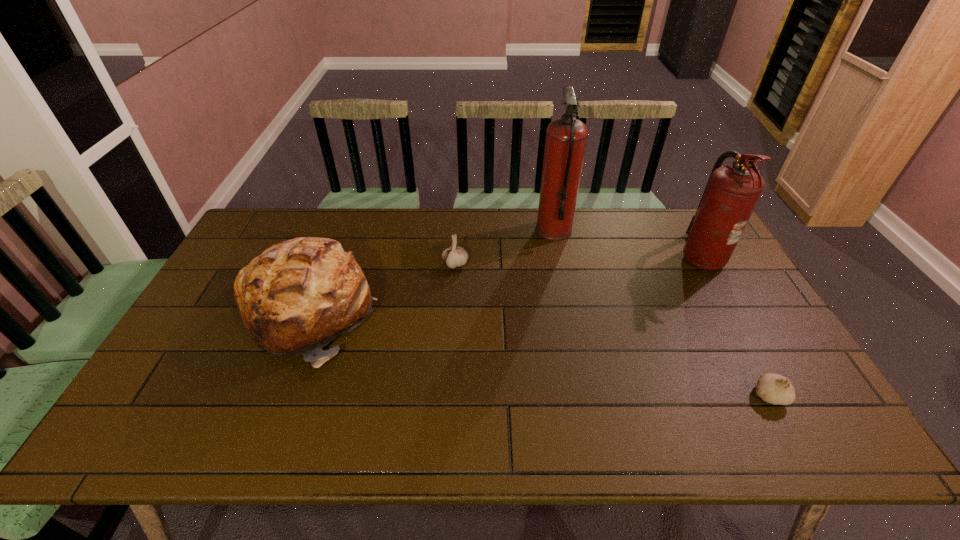
Where is `vacant point that satisfies the following two spatial constraints: 1. on the back side of the taller garlic; 2. on the left side of the bread`? This screenshot has width=960, height=540. vacant point that satisfies the following two spatial constraints: 1. on the back side of the taller garlic; 2. on the left side of the bread is located at coordinates (328, 264).

In order to click on vacant region that satisfies the following two spatial constraints: 1. at the nozzle of the third object from left to right; 2. on the front side of the taller garlic in this screenshot , I will do `click(561, 264)`.

Image resolution: width=960 pixels, height=540 pixels. I want to click on free space in the image that satisfies the following two spatial constraints: 1. at the front of the right fire extinguisher where the nozzle is aimed; 2. on the front side of the fourth object from right to left, so click(706, 264).

At what (x,y) coordinates should I click in order to perform the action: click on free space that satisfies the following two spatial constraints: 1. on the back side of the fourth tallest object; 2. on the left side of the third tallest object. Please return your answer as a coordinate pair (x, y). Looking at the image, I should click on (328, 264).

What are the coordinates of `free location that satisfies the following two spatial constraints: 1. on the front side of the farther garlic; 2. on the left side of the nearer garlic` in the screenshot? It's located at (447, 395).